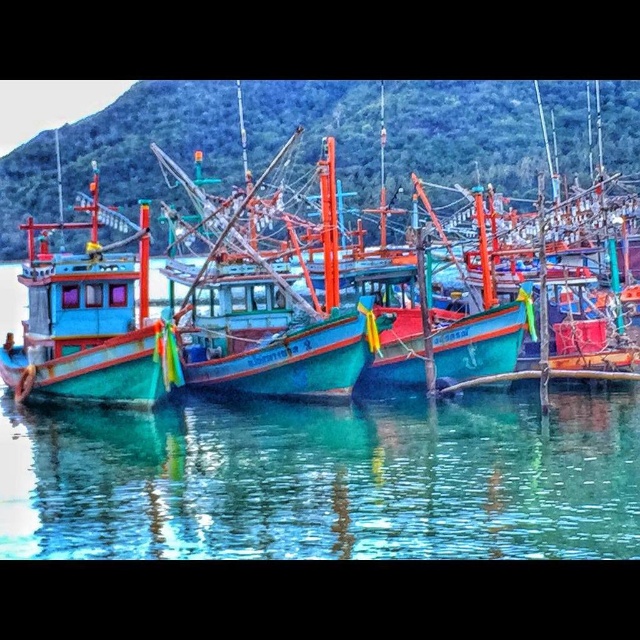
Question: Which of the following is the farthest from the observer?

Choices:
 (A) transparent water at center
 (B) teal wooden boat at center

Answer: (B)

Question: Considering the relative positions of transparent water at center and teal glossy boat at left in the image provided, where is transparent water at center located with respect to teal glossy boat at left?

Choices:
 (A) right
 (B) left

Answer: (A)

Question: Does teal wooden boat at center appear under teal glossy boat at left?

Choices:
 (A) yes
 (B) no

Answer: (B)

Question: Which point is closer to the camera taking this photo?

Choices:
 (A) (488, 486)
 (B) (540, 88)
 (C) (122, 392)

Answer: (A)

Question: Is transparent water at center bigger than teal glossy boat at left?

Choices:
 (A) no
 (B) yes

Answer: (A)

Question: Based on their relative distances, which object is farther from the teal wooden boat at center?

Choices:
 (A) transparent water at center
 (B) teal glossy boat at left

Answer: (A)